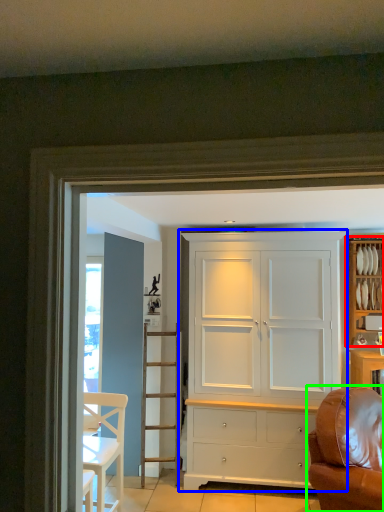
Question: Estimate the real-world distances between objects in this image. Which object is closer to cabinetry (highlighted by a red box), cupboard (highlighted by a blue box) or studio couch (highlighted by a green box)?

Choices:
 (A) cupboard
 (B) studio couch

Answer: (A)